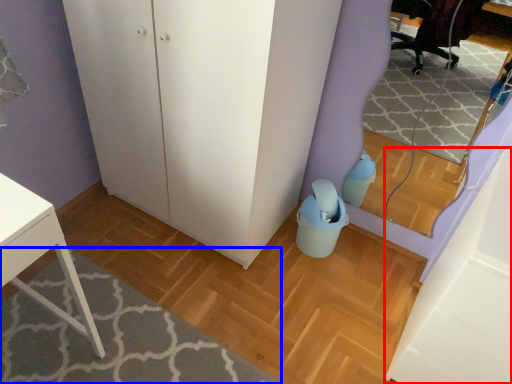
Question: Which object appears closest to the camera in this image, cabinetry (highlighted by a red box) or plain (highlighted by a blue box)?

Choices:
 (A) cabinetry
 (B) plain

Answer: (A)